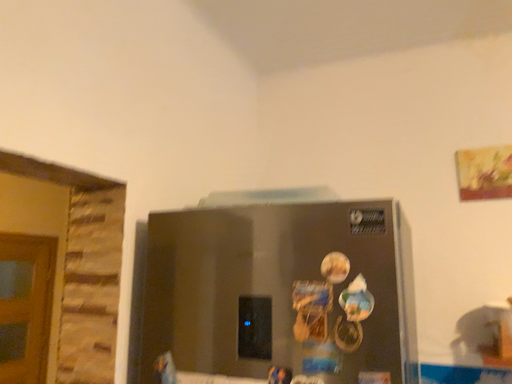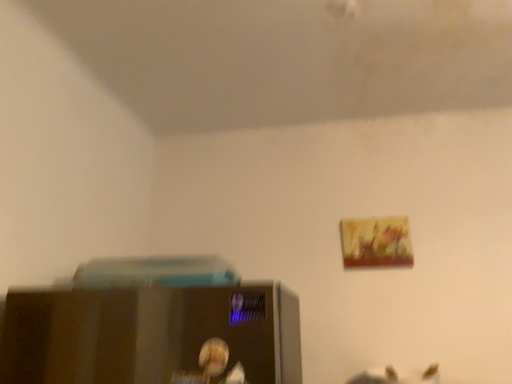
Question: How did the camera likely rotate when shooting the video?

Choices:
 (A) rotated right
 (B) rotated left

Answer: (A)